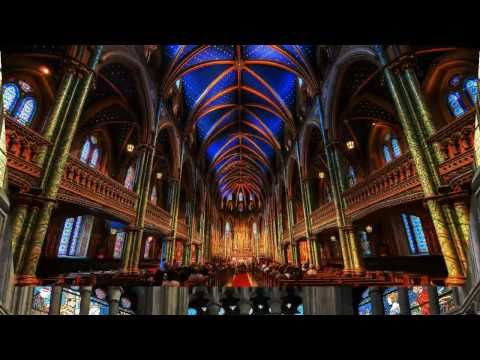
Where is `pews`? pews is located at coordinates (309, 274), (175, 275).